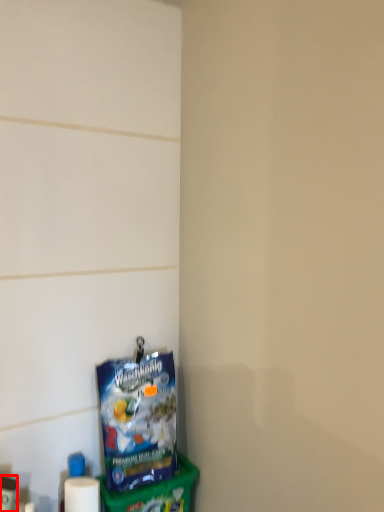
Question: From the image's perspective, where is toiletry (annotated by the red box) located relative to toy?

Choices:
 (A) above
 (B) below

Answer: (B)